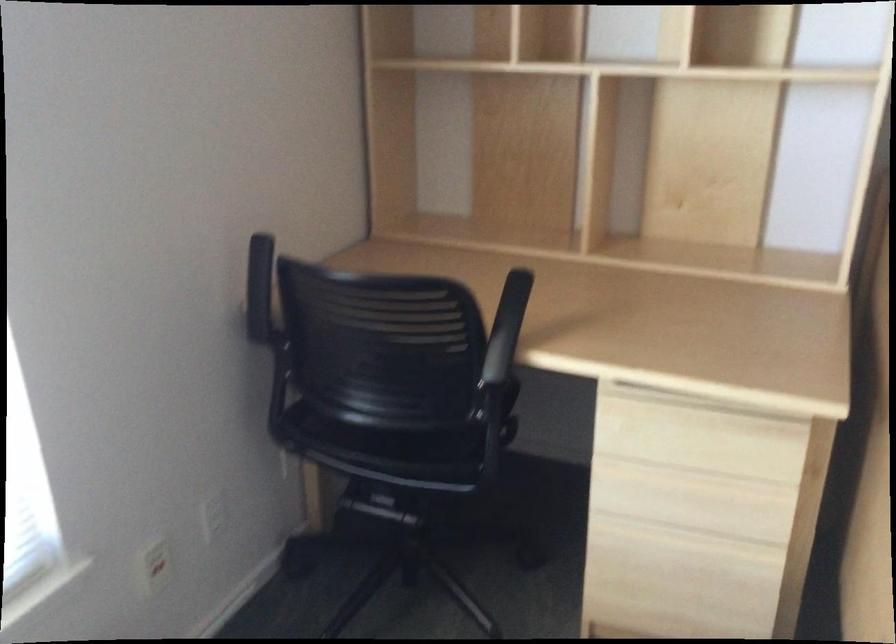
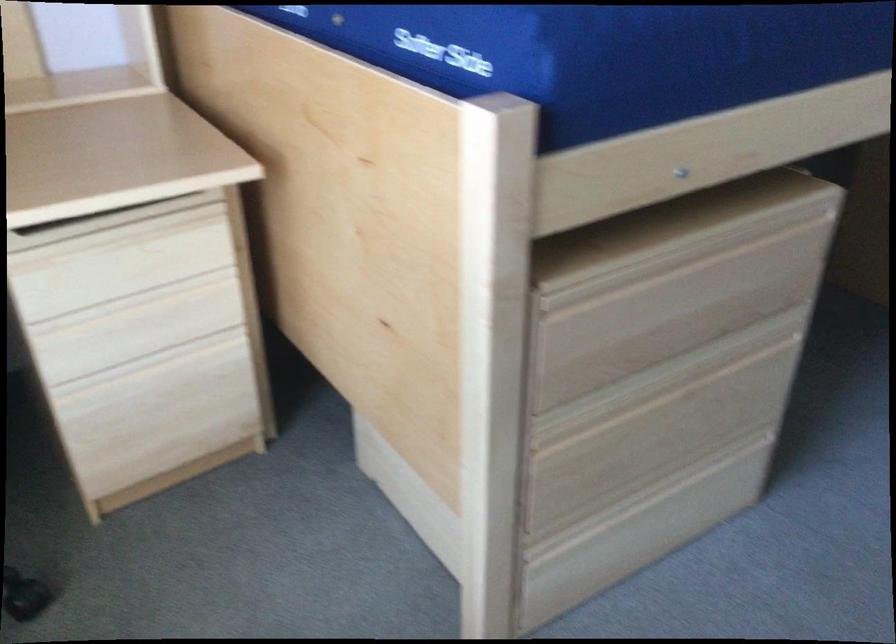
The point at (679, 533) is marked in the first image. Where is the corresponding point in the second image?

(152, 361)